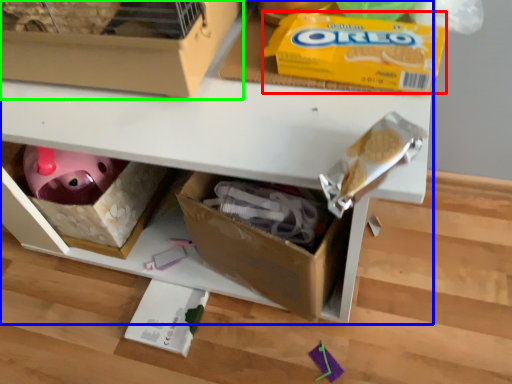
Question: Considering the real-world distances, which object is closest to cereal (highlighted by a red box)? shelf (highlighted by a blue box) or box (highlighted by a green box).

Choices:
 (A) shelf
 (B) box

Answer: (B)